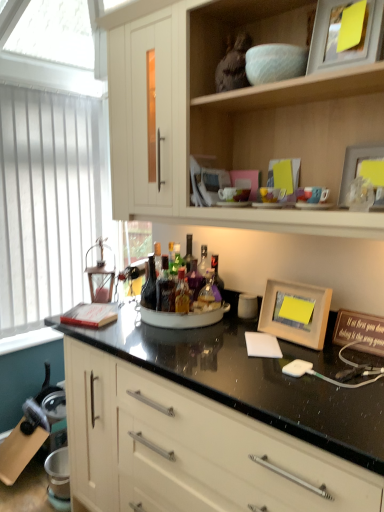
Question: Is matte wooden picture frame at upper right, which is the second picture frame from top to bottom, inside the boundaries of translucent glass bottle at center, the 1th bottle from the right, or outside?

Choices:
 (A) outside
 (B) inside

Answer: (A)

Question: Looking at the image, does matte wooden picture frame at upper right, which is the second picture frame from top to bottom, seem bigger or smaller compared to translucent glass bottle at center, the 1th bottle from the right?

Choices:
 (A) big
 (B) small

Answer: (A)

Question: Considering the real-world distances, which object is farthest from the wooden picture frame at upper right, the third picture frame when ordered from bottom to top?

Choices:
 (A) translucent glass bottle at center, the 1th bottle from the right
 (B) translucent glass bottle at center, which is the third bottle from right to left
 (C) translucent glass bottles at center, the 2th bottle when ordered from left to right
 (D) white matte notepad at center
 (E) black granite countertop at center, which ranks as the 1th cabinetry in bottom-to-top order

Answer: (E)

Question: Based on their relative distances, which object is farther from the white matte notepad at center?

Choices:
 (A) translucent glass bottles at center, the second bottle in the right-to-left sequence
 (B) translucent glass bottle at center, the 1th bottle from the right
 (C) wooden picture frame at center-right, which appears as the 1th picture frame when ordered from the bottom
 (D) matte wooden picture frame at upper right, the 2th picture frame in the bottom-to-top sequence
 (E) translucent glass bottle at center, arranged as the first bottle when viewed from the left

Answer: (D)